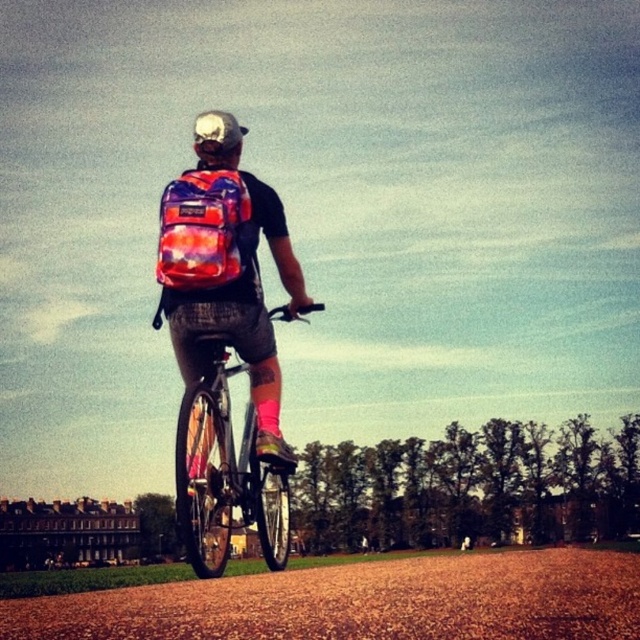
From the picture: You are a delivery person who needs to place both the brown gravel path at center and the white matte bicycle helmet at upper center into a storage box. The box can only hold items that take up less space than the other. Which item should you place first to ensure both fit?

The brown gravel path at center occupies less space than the white matte bicycle helmet at upper center, so you should place the white matte bicycle helmet at upper center first to ensure both fit in the box.

You are a pedestrian standing on the grassy area to the left of the brown gravel path at center. You want to walk to the white matte bicycle helmet at upper center. Which direction should you walk to avoid stepping on the path?

To reach the white matte bicycle helmet at upper center while avoiding the brown gravel path at center, you should walk towards the upper center direction, staying on the grassy area to the left since the path is positioned under the helmet.